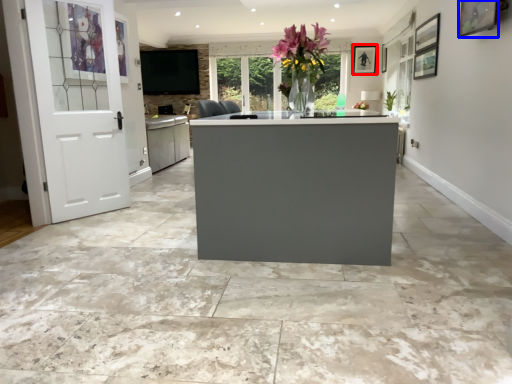
Question: Which point is further to the camera, picture frame (highlighted by a red box) or picture frame (highlighted by a blue box)?

Choices:
 (A) picture frame
 (B) picture frame

Answer: (A)